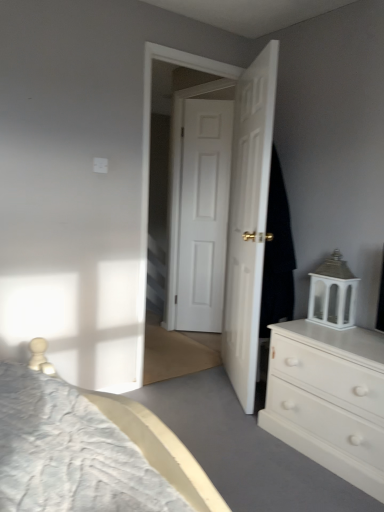
Identify the location of blank space to the left of white matte chest of drawers at right. The width and height of the screenshot is (384, 512). (241, 446).